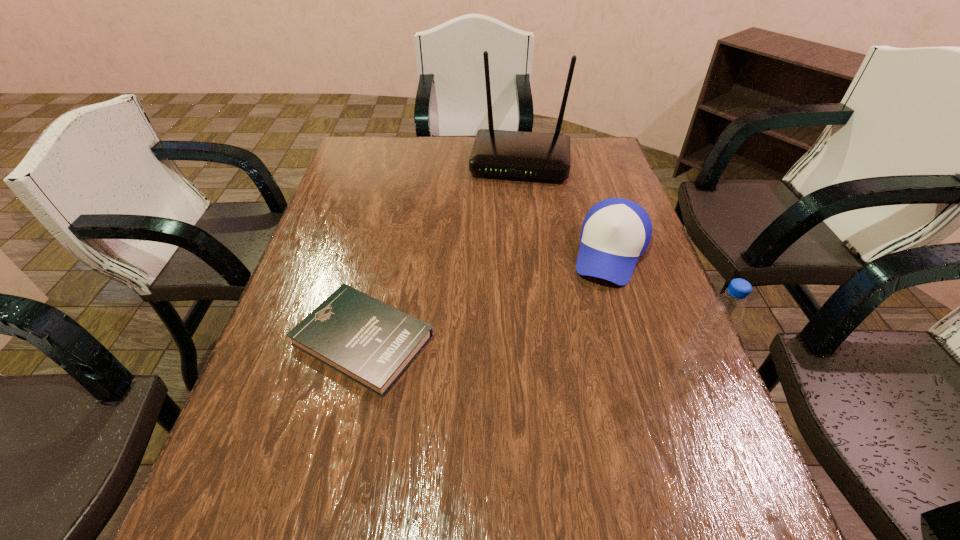
The height and width of the screenshot is (540, 960). I want to click on vacant space on the desktop that is between the shortest object and the third shortest object and is positioned on the front-facing side of the baseball cap, so click(x=569, y=359).

Find the location of a particular element. This screenshot has width=960, height=540. vacant space on the desktop that is between the book and the second tallest object and is positioned on the front-facing side of the tallest object is located at coordinates (492, 352).